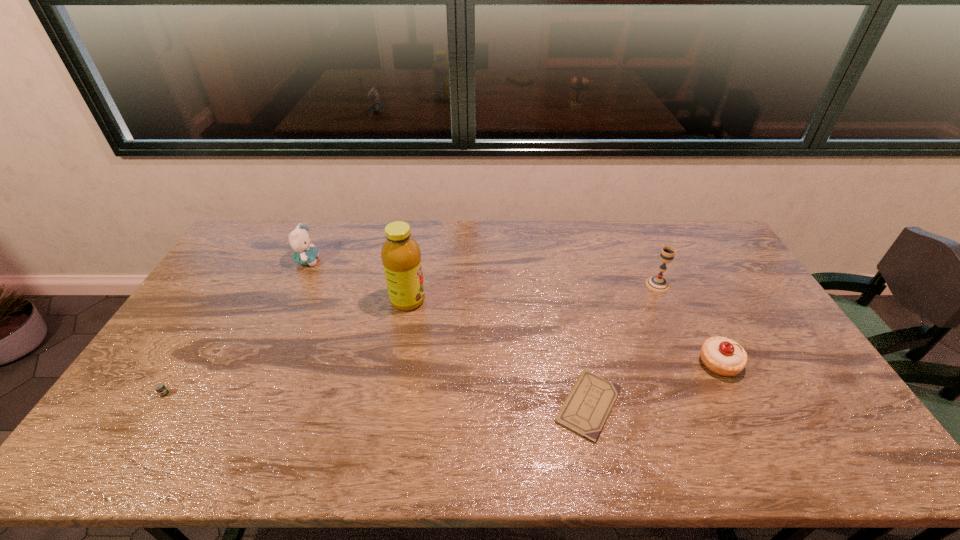
Find the location of `free space between the second shortest object and the tallest object`. free space between the second shortest object and the tallest object is located at coordinates (286, 347).

At what (x,y) coordinates should I click in order to perform the action: click on free space between the fourth object from left to right and the chalice. Please return your answer as a coordinate pair (x, y). Looking at the image, I should click on (623, 345).

Locate which object is the third closest to the pastry. Please provide its 2D coordinates. Your answer should be formatted as a tuple, i.e. [(x, y)], where the tuple contains the x and y coordinates of a point satisfying the conditions above.

[(401, 256)]

Select which object is the fourth closest to the third object from right to left. Please provide its 2D coordinates. Your answer should be formatted as a tuple, i.e. [(x, y)], where the tuple contains the x and y coordinates of a point satisfying the conditions above.

[(299, 239)]

Find the location of a particular element. free region that satisfies the following two spatial constraints: 1. on the face of the kitten; 2. on the left side of the shortest object is located at coordinates (240, 406).

I want to click on vacant position in the image that satisfies the following two spatial constraints: 1. on the face of the chalice; 2. on the right side of the kitten, so click(297, 285).

Find the location of a particular element. The height and width of the screenshot is (540, 960). vacant space that satisfies the following two spatial constraints: 1. on the front label of the third object from left to right; 2. on the front side of the leftmost object is located at coordinates [391, 394].

Locate an element on the screen. The width and height of the screenshot is (960, 540). vacant space that satisfies the following two spatial constraints: 1. on the back side of the third shortest object; 2. on the front label of the tallest object is located at coordinates (687, 300).

Image resolution: width=960 pixels, height=540 pixels. What are the coordinates of `free region that satisfies the following two spatial constraints: 1. on the face of the fourth tallest object; 2. on the right side of the fifth object from right to left` in the screenshot? It's located at (259, 363).